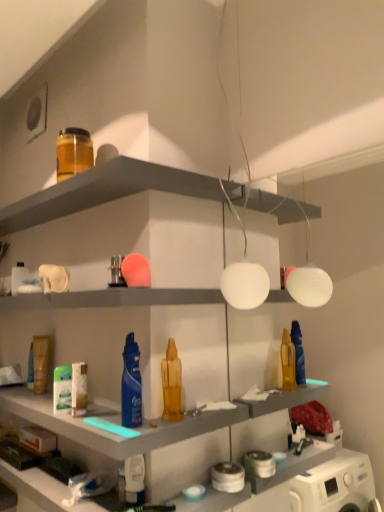
Question: Could you tell me if white matte tube at center, acting as the 3th toiletry starting from the left, is facing matte plastic shelf at upper center?

Choices:
 (A) no
 (B) yes

Answer: (A)

Question: Is white matte tube at center, which appears as the 4th toiletry when viewed from the top, positioned far away from matte plastic shelf at upper center?

Choices:
 (A) yes
 (B) no

Answer: (B)

Question: From a real-world perspective, is white matte tube at center, which appears as the 4th toiletry when viewed from the top, beneath matte plastic shelf at upper center?

Choices:
 (A) no
 (B) yes

Answer: (B)

Question: Does white matte tube at center, which appears as the 4th toiletry when viewed from the top, come behind matte plastic shelf at upper center?

Choices:
 (A) yes
 (B) no

Answer: (A)

Question: Is white matte tube at center, which ranks as the 4th toiletry in right-to-left order, smaller than matte plastic shelf at upper center?

Choices:
 (A) no
 (B) yes

Answer: (B)

Question: Is white matte tube at center, which ranks as the 4th toiletry in right-to-left order, positioned with its back to matte plastic shelf at upper center?

Choices:
 (A) no
 (B) yes

Answer: (A)

Question: From the image's perspective, is matte plastic shelf at upper center located above translucent amber bottle at center, positioned as the third toiletry in top-to-bottom order?

Choices:
 (A) yes
 (B) no

Answer: (A)

Question: Is matte plastic shelf at upper center shorter than translucent amber bottle at center, which is the 6th toiletry from left to right?

Choices:
 (A) no
 (B) yes

Answer: (B)

Question: From a real-world perspective, is matte plastic shelf at upper center on translucent amber bottle at center, acting as the 2th toiletry starting from the front?

Choices:
 (A) no
 (B) yes

Answer: (B)

Question: Is matte plastic shelf at upper center closer to camera compared to translucent amber bottle at center, positioned as the third toiletry in top-to-bottom order?

Choices:
 (A) yes
 (B) no

Answer: (A)

Question: Can you confirm if matte plastic shelf at upper center is bigger than translucent amber bottle at center, marked as the fourth toiletry in a bottom-to-top arrangement?

Choices:
 (A) no
 (B) yes

Answer: (B)

Question: Considering the relative sizes of matte plastic shelf at upper center and translucent amber bottle at center, the 1th toiletry viewed from the right, in the image provided, is matte plastic shelf at upper center smaller than translucent amber bottle at center, the 1th toiletry viewed from the right,?

Choices:
 (A) no
 (B) yes

Answer: (A)

Question: Is metallic silver toiletry at center, marked as the third toiletry in a front-to-back arrangement, wider than white glossy lotion at lower center, which is counted as the sixth toiletry, starting from the back?

Choices:
 (A) yes
 (B) no

Answer: (A)